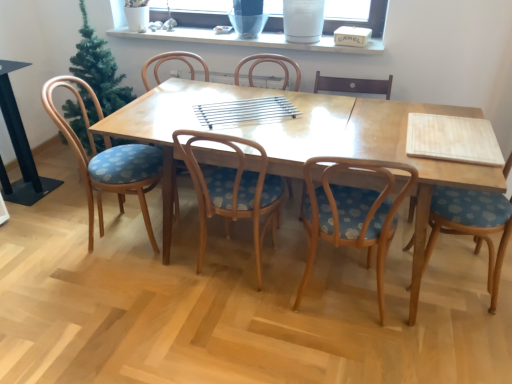
At what (x,y) coordinates should I click in order to perform the action: click on unoccupied area in front of wooden chair with blue cushion at center, which is counted as the 4th chair, starting from the right. Please return your answer as a coordinate pair (x, y). The width and height of the screenshot is (512, 384). Looking at the image, I should click on (227, 342).